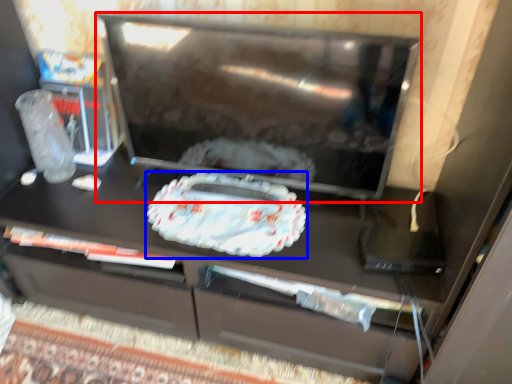
Question: Which object is further to the camera taking this photo, appliance (highlighted by a red box) or food (highlighted by a blue box)?

Choices:
 (A) appliance
 (B) food

Answer: (B)